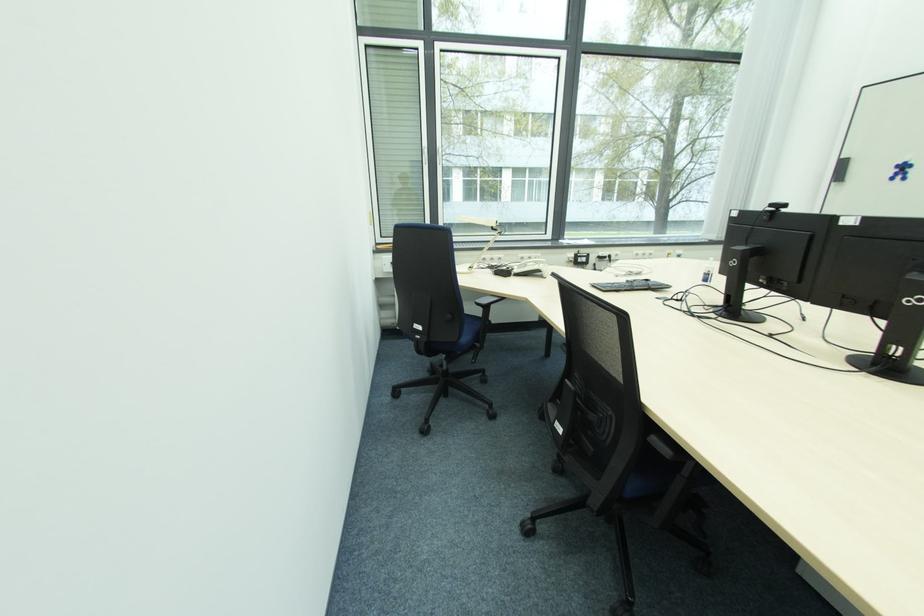
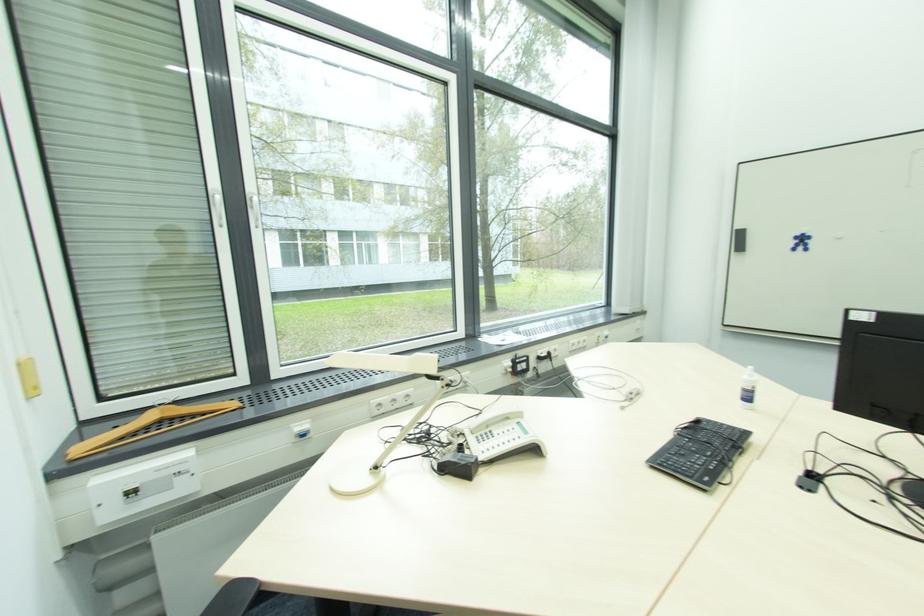
Where in the second image is the point corresponding to pixel 473 270 from the first image?

(380, 469)